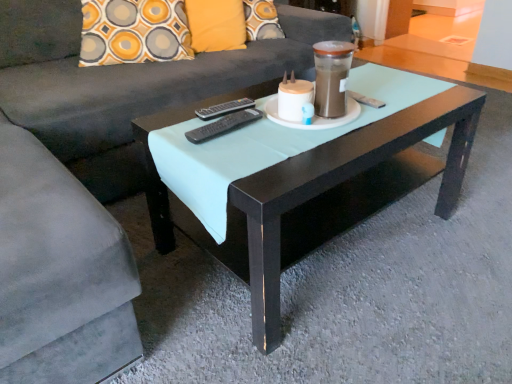
Where is `vacant area that is situated to the right of black plastic remote at center, the 1th remote in the back-to-front sequence`? This screenshot has width=512, height=384. vacant area that is situated to the right of black plastic remote at center, the 1th remote in the back-to-front sequence is located at coordinates (270, 114).